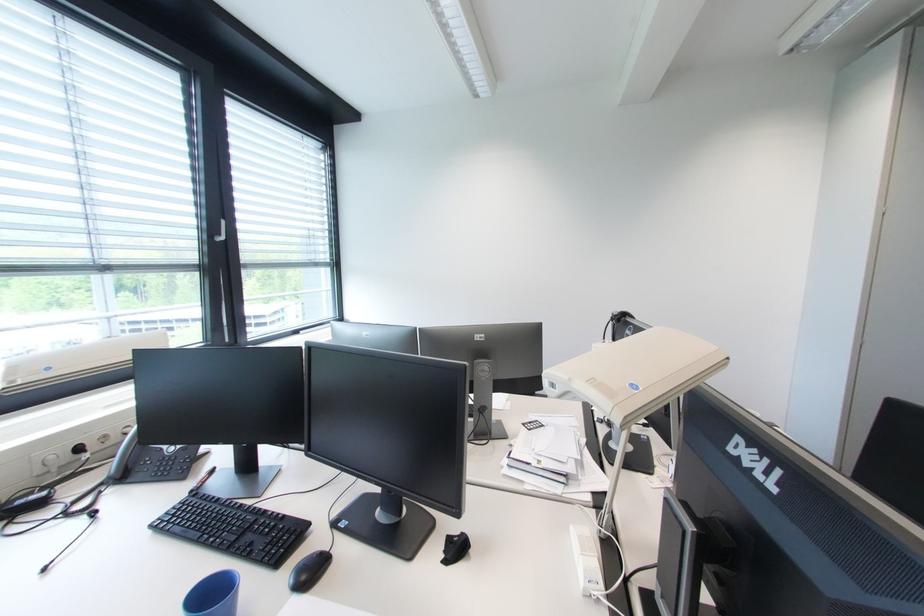
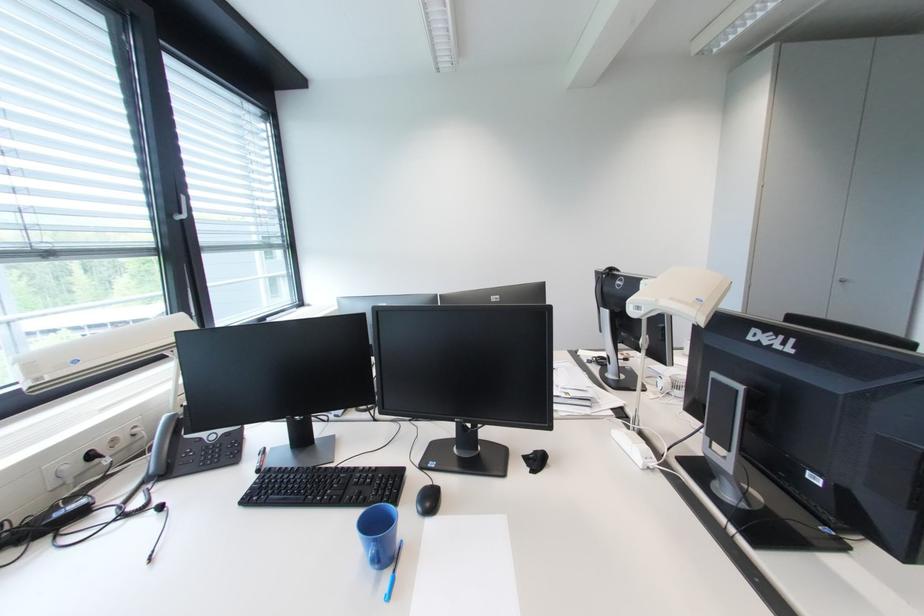
The point at [86,451] is marked in the first image. Where is the corresponding point in the second image?

(98, 458)